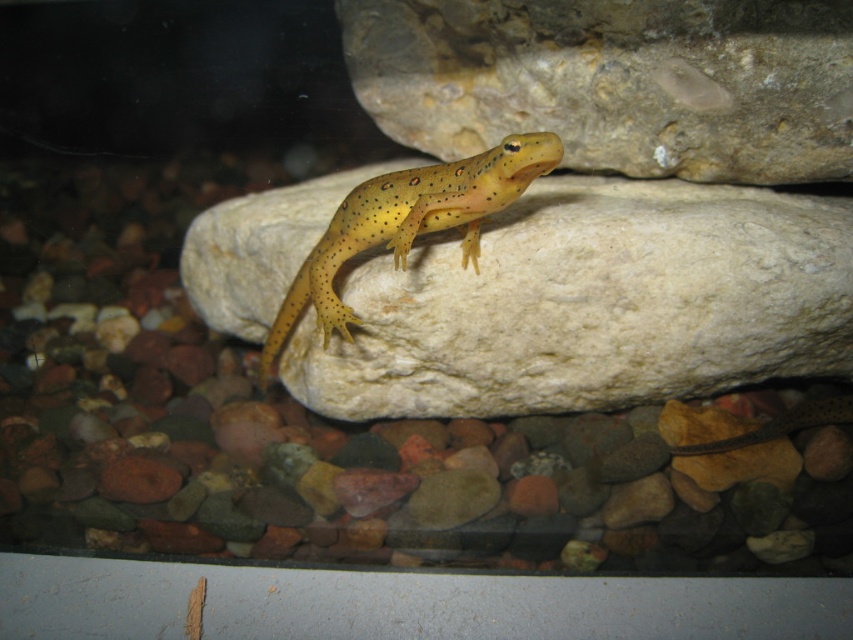
Question: Is white smooth rock at center above yellow spotted lizard at center?

Choices:
 (A) yes
 (B) no

Answer: (B)

Question: Which of the following is the farthest from the observer?

Choices:
 (A) yellow spotted lizard at center
 (B) smooth rock at upper center

Answer: (B)

Question: Is smooth rock at upper center to the left of yellow spotted lizard at center from the viewer's perspective?

Choices:
 (A) yes
 (B) no

Answer: (B)

Question: Considering the real-world distances, which object is closest to the smooth rock at upper center?

Choices:
 (A) yellow spotted lizard at center
 (B) white smooth rock at center

Answer: (B)

Question: Is white smooth rock at center closer to camera compared to yellow spotted lizard at center?

Choices:
 (A) no
 (B) yes

Answer: (A)

Question: Estimate the real-world distances between objects in this image. Which object is closer to the smooth rock at upper center?

Choices:
 (A) white smooth rock at center
 (B) yellow spotted lizard at center

Answer: (A)